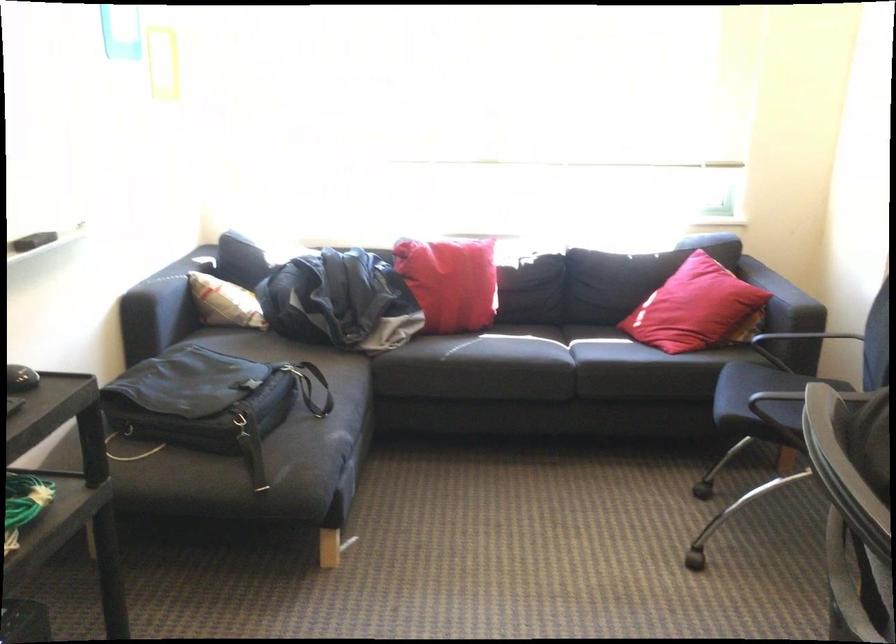
Identify the location of dark sofa armrest. The height and width of the screenshot is (644, 896). (782, 298).